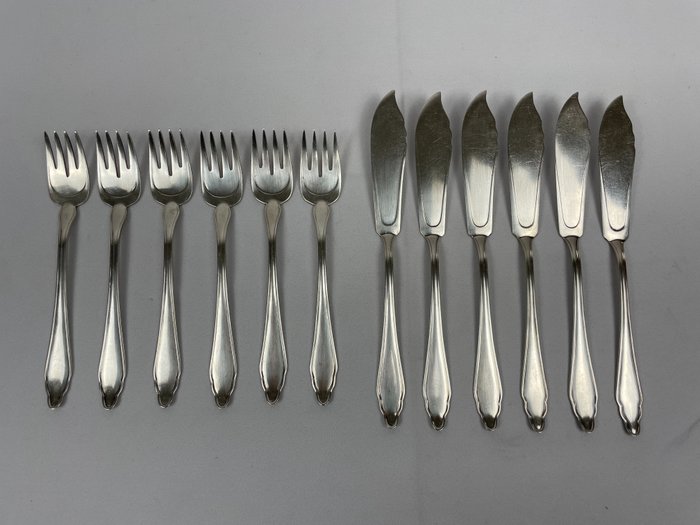
Identify the location of knives. (385, 190), (441, 162), (483, 163), (519, 165), (570, 162), (623, 165).